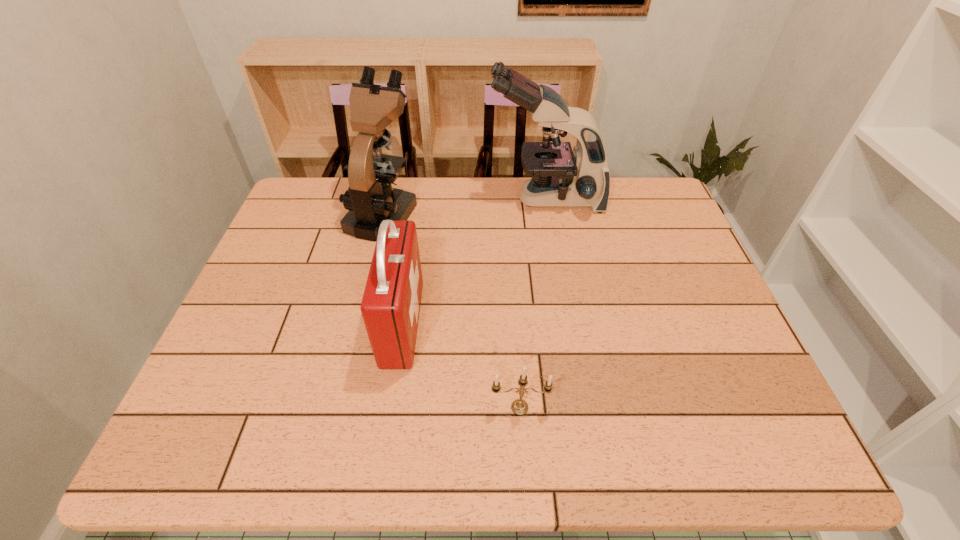
This screenshot has height=540, width=960. I want to click on unoccupied position between the second shortest object and the shortest object, so click(461, 366).

You are a GUI agent. You are given a task and a screenshot of the screen. Output one action in this format:
    pyautogui.click(x=<x>, y=<y>)
    Task: Click on the free spot between the shortest object and the left microscope
    Image resolution: width=960 pixels, height=540 pixels.
    Given the screenshot: What is the action you would take?
    pyautogui.click(x=451, y=310)

At what (x,y) coordinates should I click in order to perform the action: click on free space between the right microscope and the left microscope. Please return your answer as a coordinate pair (x, y). Image resolution: width=960 pixels, height=540 pixels. Looking at the image, I should click on (464, 206).

At what (x,y) coordinates should I click in order to perform the action: click on vacant area that lies between the left microscope and the right microscope. Please return your answer as a coordinate pair (x, y). The image size is (960, 540). Looking at the image, I should click on (464, 206).

At what (x,y) coordinates should I click in order to perform the action: click on blank region between the right microscope and the candle. Please return your answer as a coordinate pair (x, y). The height and width of the screenshot is (540, 960). Looking at the image, I should click on click(x=533, y=303).

Locate an element on the screen. This screenshot has width=960, height=540. free spot between the candle and the right microscope is located at coordinates (533, 303).

Identify which object is located as the third nearest to the candle. Please provide its 2D coordinates. Your answer should be formatted as a tuple, i.e. [(x, y)], where the tuple contains the x and y coordinates of a point satisfying the conditions above.

[(560, 177)]

The image size is (960, 540). Identify the location of object that stands as the closest to the right microscope. (370, 198).

You are a GUI agent. You are given a task and a screenshot of the screen. Output one action in this format:
    pyautogui.click(x=<x>, y=<y>)
    Task: Click on the vacant area that satisfies the following two spatial constraints: 1. on the back side of the shortest object; 2. on the front face of the second shortest object
    The image size is (960, 540).
    Given the screenshot: What is the action you would take?
    515,324

Where is `free location that satisfies the following two spatial constraints: 1. through the eyepieces of the right microscope; 2. on the front side of the shortest object`? The width and height of the screenshot is (960, 540). free location that satisfies the following two spatial constraints: 1. through the eyepieces of the right microscope; 2. on the front side of the shortest object is located at coordinates tap(582, 408).